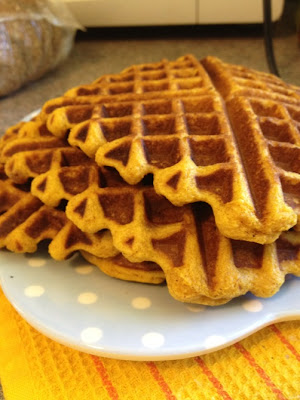
Locate an element on the screen. This screenshot has height=400, width=300. white cabinets is located at coordinates 163,13, 226,11.